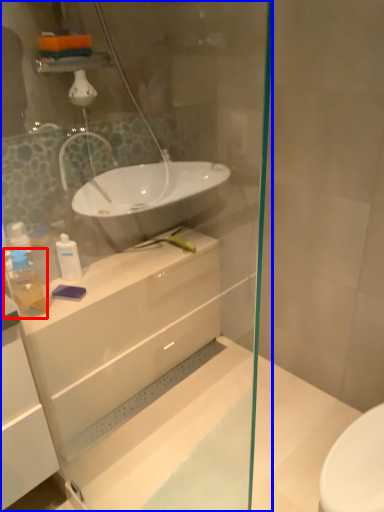
Question: Which object is further to the camera taking this photo, toiletry (highlighted by a red box) or shower door (highlighted by a blue box)?

Choices:
 (A) toiletry
 (B) shower door

Answer: (A)